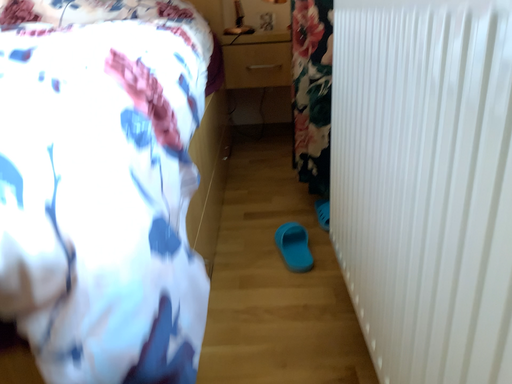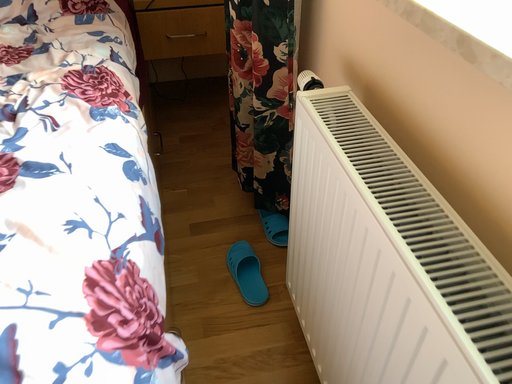
Question: Which way did the camera rotate in the video?

Choices:
 (A) rotated left
 (B) rotated right

Answer: (B)